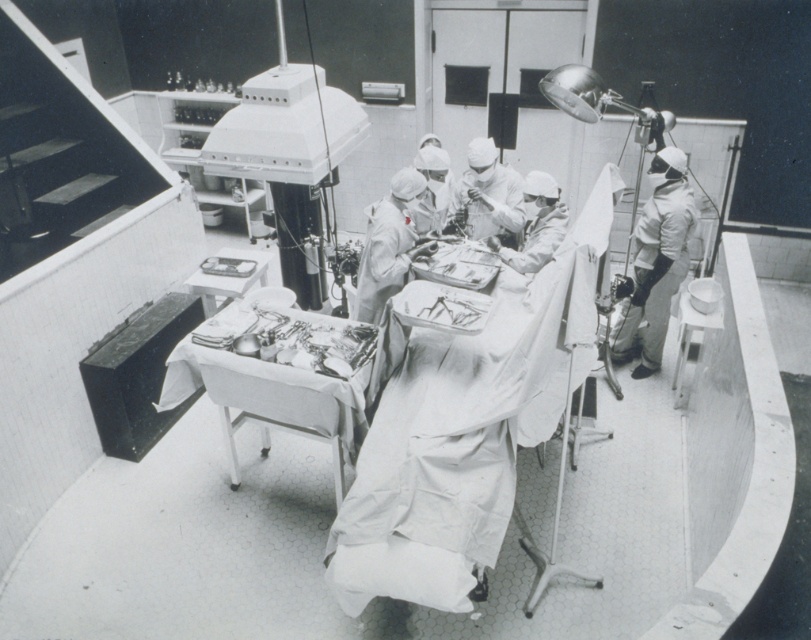
You are a surgical assistant who needs to retrieve a scalpel from the metallic silver tray at center. You are currently standing next to the white matte uniform at right. Which direction should you move to reach the tray?

The metallic silver tray at center is to the left of the white matte uniform at right, so you should move to your left to reach the tray.

Based on the photo, you are a medical student observing a surgical procedure from the viewer position in the operating room. The instructor asks you to locate a specific point marked in the scene. The point is at coordinates point (x=235, y=422). Can you estimate how far this point is from your current position?

The point (x=235, y=422) is 14.14 feet away from the viewer.